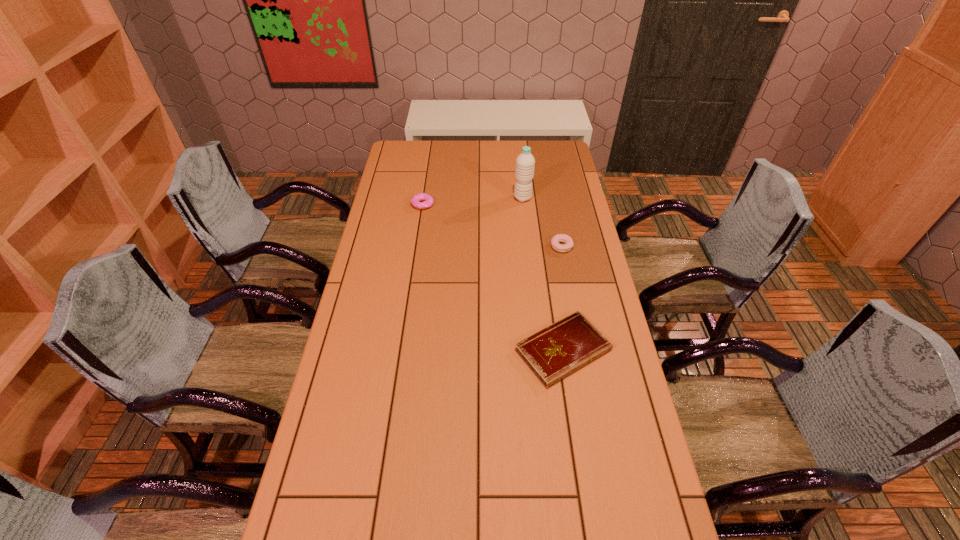
This screenshot has height=540, width=960. I want to click on free location located on the back of the nearest object, so click(x=549, y=259).

Where is `object at the left edge`? This screenshot has height=540, width=960. object at the left edge is located at coordinates (428, 200).

Image resolution: width=960 pixels, height=540 pixels. What are the coordinates of `doughnut at the right edge` in the screenshot? It's located at (555, 241).

Where is `notebook positioned at the right edge`? Image resolution: width=960 pixels, height=540 pixels. notebook positioned at the right edge is located at coordinates (553, 353).

The width and height of the screenshot is (960, 540). Identify the location of vacant space at the far edge of the desktop. (429, 145).

What are the coordinates of `vacant space at the left edge of the desktop` in the screenshot? It's located at (408, 245).

You are a GUI agent. You are given a task and a screenshot of the screen. Output one action in this format:
    pyautogui.click(x=<x>, y=<y>)
    Task: Click on the vacant space at the right edge of the desktop
    The width and height of the screenshot is (960, 540).
    Given the screenshot: What is the action you would take?
    pyautogui.click(x=600, y=485)

What are the coordinates of `vacant space at the far left corner of the desktop` in the screenshot? It's located at (420, 141).

Where is `free space between the shortest object and the third farthest object`? The image size is (960, 540). free space between the shortest object and the third farthest object is located at coordinates (563, 298).

Where is `unoccupied area between the farther doughnut and the shortest object`? Image resolution: width=960 pixels, height=540 pixels. unoccupied area between the farther doughnut and the shortest object is located at coordinates pyautogui.click(x=493, y=277).